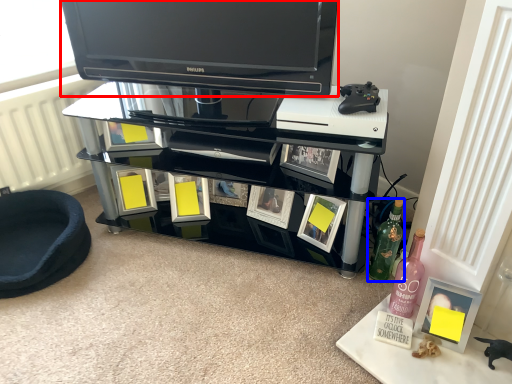
Question: Which point is closer to the camera, television (highlighted by a red box) or bottle (highlighted by a blue box)?

Choices:
 (A) television
 (B) bottle

Answer: (A)